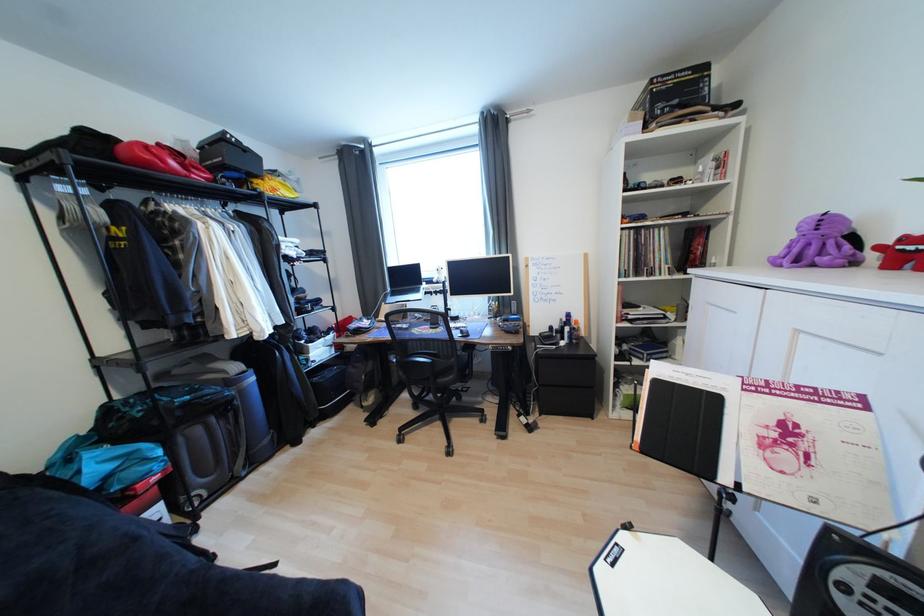
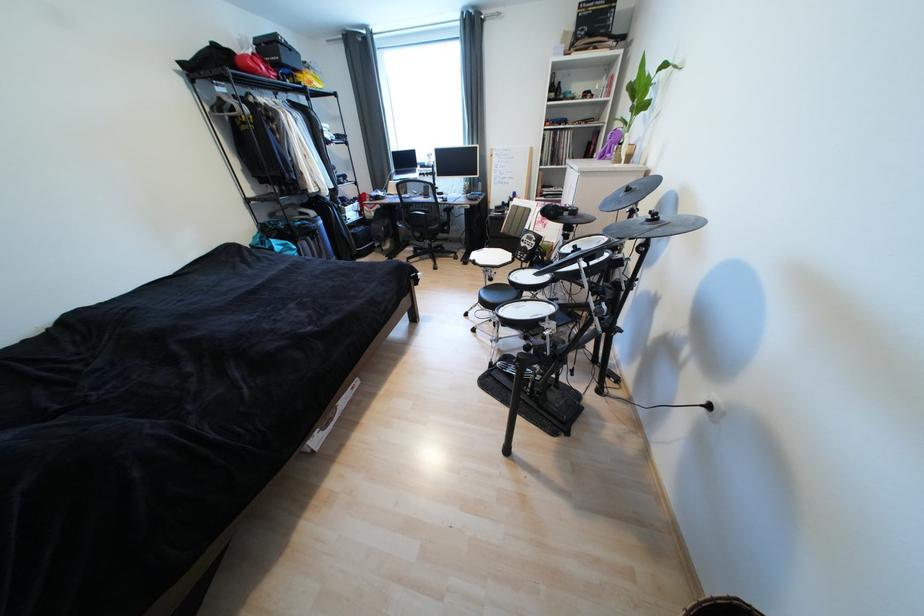
Find the pixel in the second image that matches point 244,171 in the first image.

(294, 68)